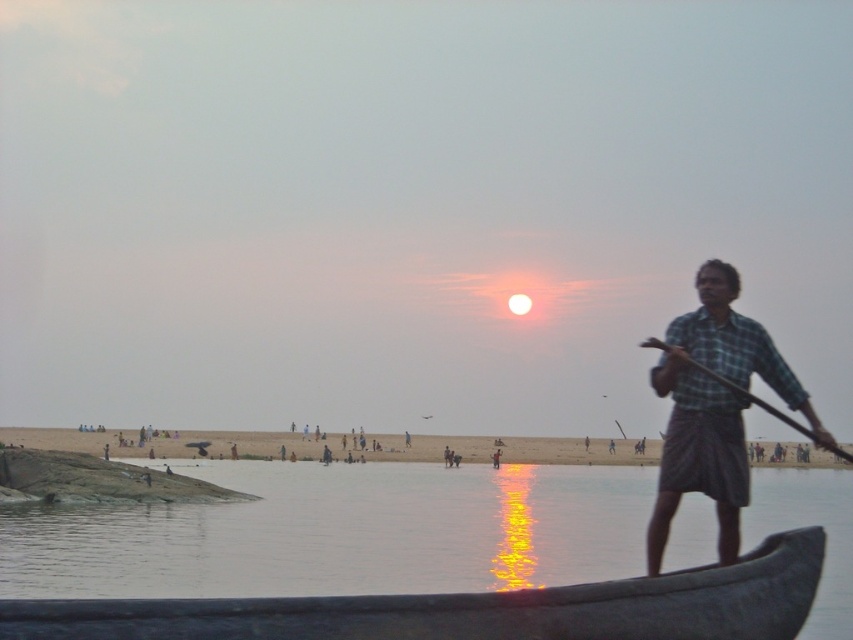
You are a photographer trying to capture the sunset scene. You have two points marked on your camera screen at coordinates point (664,451) and point (776,410). Which point is closer to the camera?

Point (776,410) is closer to the camera because it is in front of point (664,451).

You are a photographer trying to capture the sunset scene. You want to ensure that both the smooth water at boat front and the wooden at right are clearly visible in your photo. Given their sizes, which object should you focus on first to ensure it fits well within the frame?

The smooth water at boat front has a larger size compared to wooden at right, so you should focus on capturing the smooth water at boat front first to ensure it fits well within the frame.